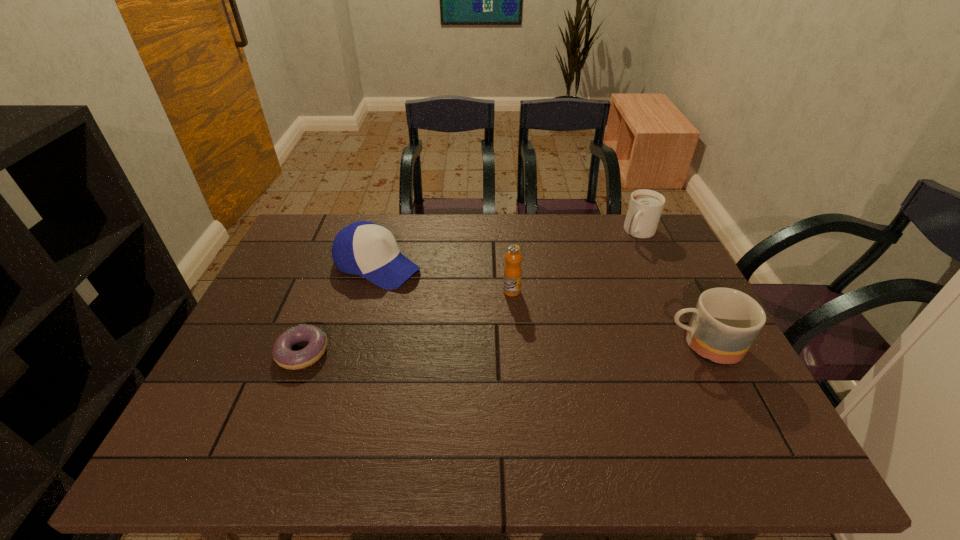
Find the location of a particular element. vacant spot on the desktop that is between the doughnut and the mug and is positioned on the side with the handle of the cappuccino is located at coordinates (558, 348).

The width and height of the screenshot is (960, 540). Find the location of `vacant space on the desktop that is between the doughnut and the mug and is positioned on the front-facing side of the baseball cap`. vacant space on the desktop that is between the doughnut and the mug and is positioned on the front-facing side of the baseball cap is located at coordinates (537, 348).

Find the location of a particular element. This screenshot has width=960, height=540. free spot on the desktop that is between the shortest object and the mug and is positioned on the front label of the orange juice is located at coordinates (529, 348).